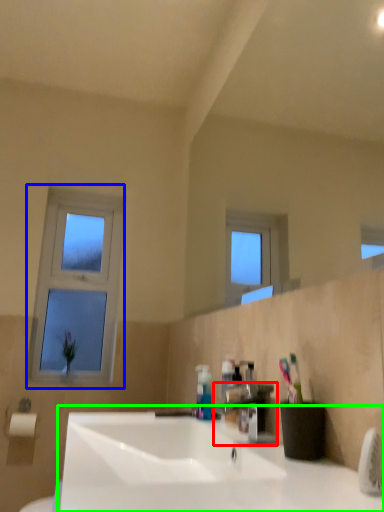
Question: Based on their relative distances, which object is nearer to tap (highlighted by a red box)? Choose from window (highlighted by a blue box) and sink (highlighted by a green box).

Choices:
 (A) window
 (B) sink

Answer: (B)